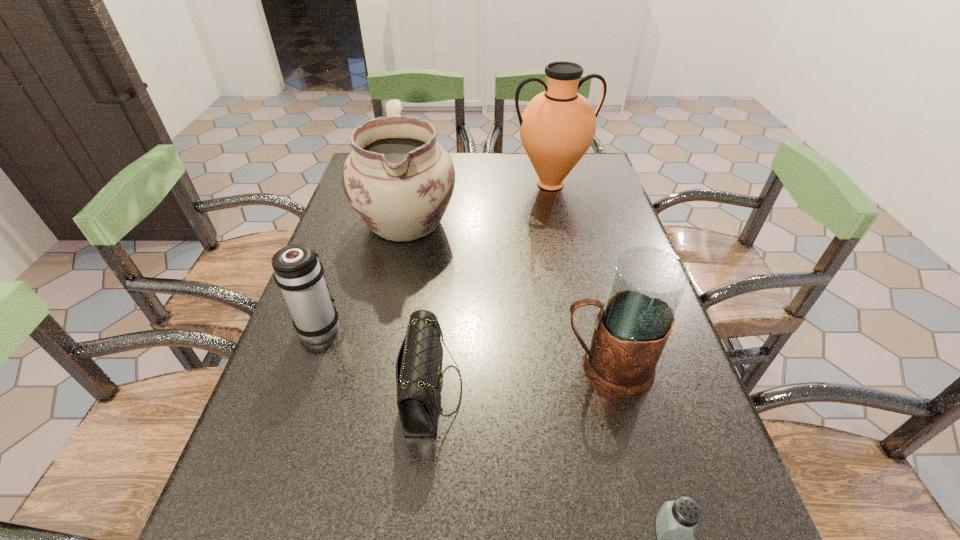
Find the location of a particular element. vacant region at the right edge of the desktop is located at coordinates (609, 282).

The image size is (960, 540). In the image, there is a desktop. Find the location of `free region at the far right corner`. free region at the far right corner is located at coordinates (589, 153).

Image resolution: width=960 pixels, height=540 pixels. What are the coordinates of `unoccupied position between the nearest pitcher and the second shortest object` in the screenshot? It's located at (519, 379).

Locate an element on the screen. This screenshot has width=960, height=540. vacant area between the second shortest object and the thermos bottle is located at coordinates (376, 357).

I want to click on vacant space that's between the leftmost pitcher and the thermos bottle, so click(364, 272).

Find the location of a particular element. This screenshot has width=960, height=540. free spot between the leftmost pitcher and the thermos bottle is located at coordinates (364, 272).

Identify which object is located as the fourth nearest to the leftmost pitcher. Please provide its 2D coordinates. Your answer should be formatted as a tuple, i.e. [(x, y)], where the tuple contains the x and y coordinates of a point satisfying the conditions above.

[(632, 327)]

Locate which object is the fifth closest to the nearest pitcher. Please provide its 2D coordinates. Your answer should be formatted as a tuple, i.e. [(x, y)], where the tuple contains the x and y coordinates of a point satisfying the conditions above.

[(557, 127)]

Select which pitcher appears as the second closest to the leftmost pitcher. Please provide its 2D coordinates. Your answer should be formatted as a tuple, i.e. [(x, y)], where the tuple contains the x and y coordinates of a point satisfying the conditions above.

[(632, 327)]

Select which pitcher is the second closest to the leftmost pitcher. Please provide its 2D coordinates. Your answer should be formatted as a tuple, i.e. [(x, y)], where the tuple contains the x and y coordinates of a point satisfying the conditions above.

[(632, 327)]